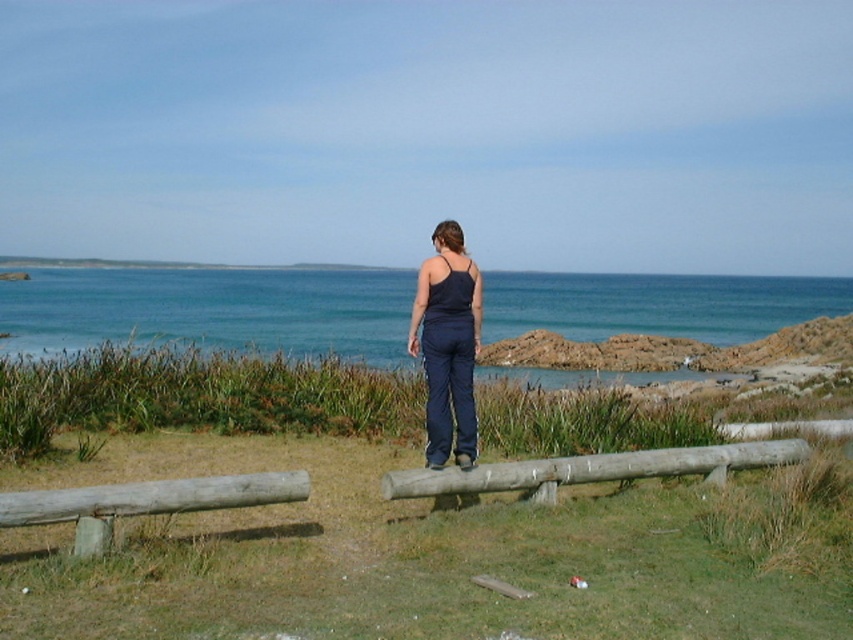
Question: Considering the real-world distances, which object is farthest from the gray weathered log at lower left?

Choices:
 (A) navy blue fabric pants at center
 (B) blue water at center
 (C) smooth wooden log at center

Answer: (B)

Question: Does smooth wooden log at center come behind gray weathered log at lower left?

Choices:
 (A) no
 (B) yes

Answer: (B)

Question: Which of the following is the farthest from the observer?

Choices:
 (A) smooth wooden log at center
 (B) gray weathered log at lower left
 (C) blue water at center

Answer: (C)

Question: Which point is farther from the camera taking this photo?

Choices:
 (A) (732, 468)
 (B) (213, 310)
 (C) (62, 516)
 (D) (438, 314)

Answer: (B)

Question: Is navy blue fabric pants at center positioned behind smooth wooden log at center?

Choices:
 (A) no
 (B) yes

Answer: (A)

Question: Observing the image, what is the correct spatial positioning of navy blue fabric pants at center in reference to smooth wooden log at center?

Choices:
 (A) above
 (B) below

Answer: (A)